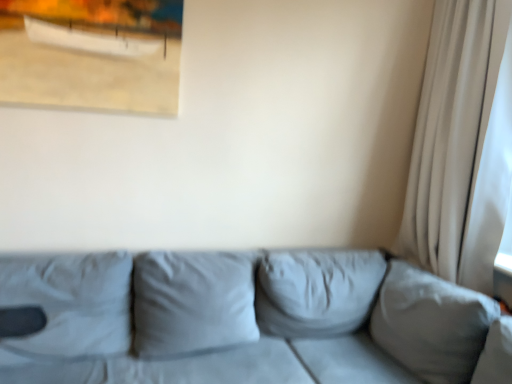
Question: Considering the relative sizes of suede gray couch at center and matte wooden picture frame at upper left in the image provided, is suede gray couch at center smaller than matte wooden picture frame at upper left?

Choices:
 (A) no
 (B) yes

Answer: (A)

Question: Does suede gray couch at center come in front of matte wooden picture frame at upper left?

Choices:
 (A) no
 (B) yes

Answer: (B)

Question: Considering the relative sizes of suede gray couch at center and matte wooden picture frame at upper left in the image provided, is suede gray couch at center shorter than matte wooden picture frame at upper left?

Choices:
 (A) yes
 (B) no

Answer: (B)

Question: Considering the relative positions of suede gray couch at center and matte wooden picture frame at upper left in the image provided, is suede gray couch at center to the left of matte wooden picture frame at upper left from the viewer's perspective?

Choices:
 (A) no
 (B) yes

Answer: (A)

Question: From a real-world perspective, is suede gray couch at center beneath matte wooden picture frame at upper left?

Choices:
 (A) yes
 (B) no

Answer: (A)

Question: From a real-world perspective, is suede gray couch at center on top of matte wooden picture frame at upper left?

Choices:
 (A) yes
 (B) no

Answer: (B)

Question: Is white sheer curtain at right inside suede gray couch at center?

Choices:
 (A) yes
 (B) no

Answer: (B)

Question: From the image's perspective, is suede gray couch at center beneath white sheer curtain at right?

Choices:
 (A) yes
 (B) no

Answer: (A)

Question: Is suede gray couch at center outside white sheer curtain at right?

Choices:
 (A) yes
 (B) no

Answer: (A)

Question: Is the position of suede gray couch at center more distant than that of white sheer curtain at right?

Choices:
 (A) yes
 (B) no

Answer: (B)

Question: Is suede gray couch at center positioned with its back to white sheer curtain at right?

Choices:
 (A) yes
 (B) no

Answer: (B)

Question: Can you confirm if suede gray couch at center is smaller than white sheer curtain at right?

Choices:
 (A) no
 (B) yes

Answer: (A)

Question: From the image's perspective, does white sheer curtain at right appear higher than suede gray couch at center?

Choices:
 (A) no
 (B) yes

Answer: (B)